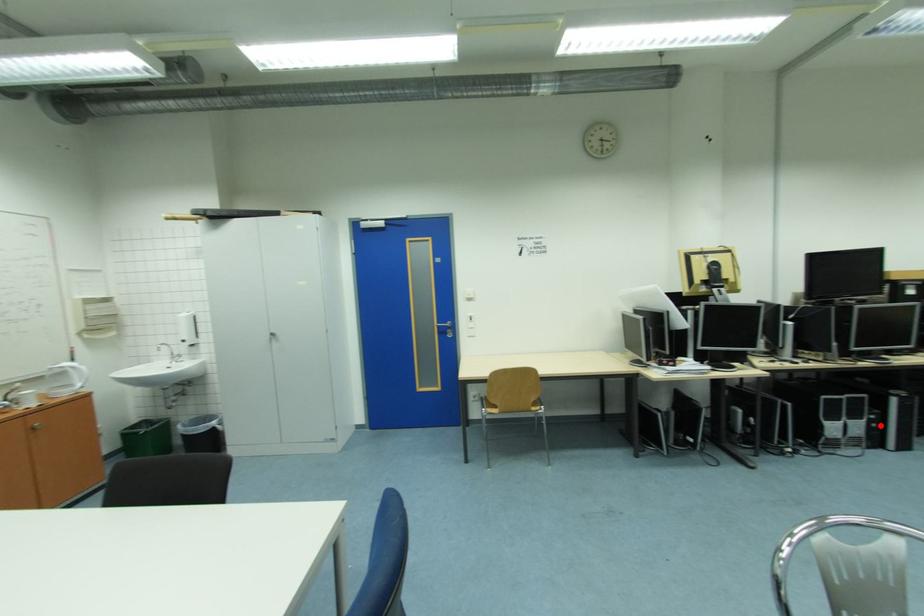
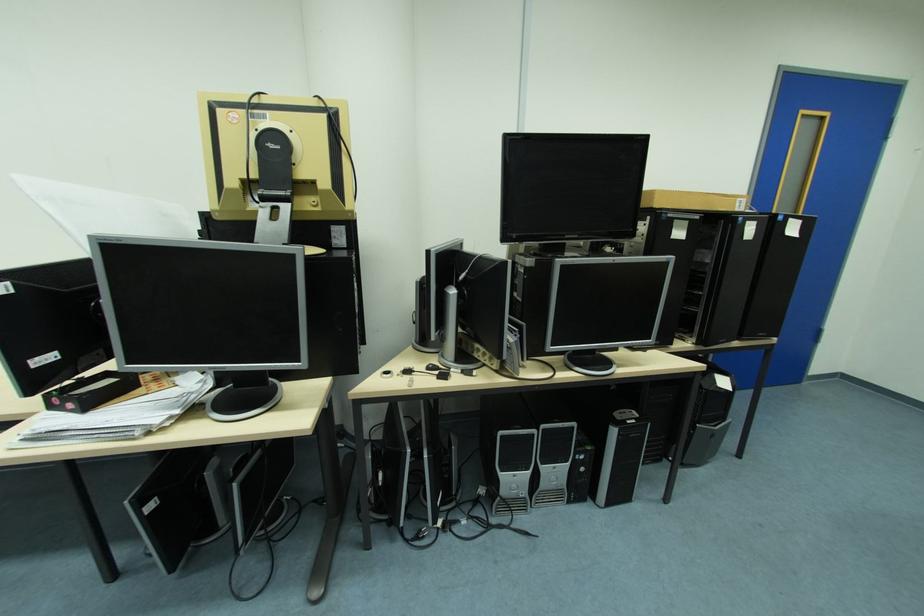
Locate, in the second image, the point that corresponds to the highlighted location in the first image.

(590, 469)